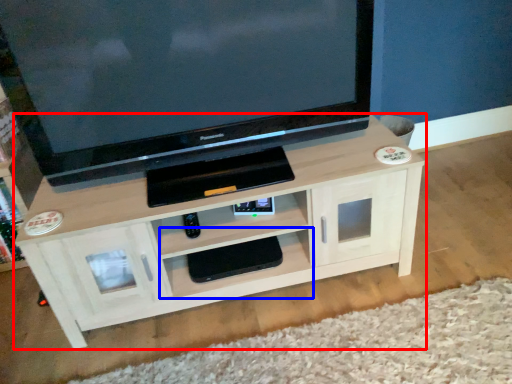
Question: Which of the following is the farthest to the observer, shelf (highlighted by a red box) or shelf (highlighted by a blue box)?

Choices:
 (A) shelf
 (B) shelf

Answer: (B)